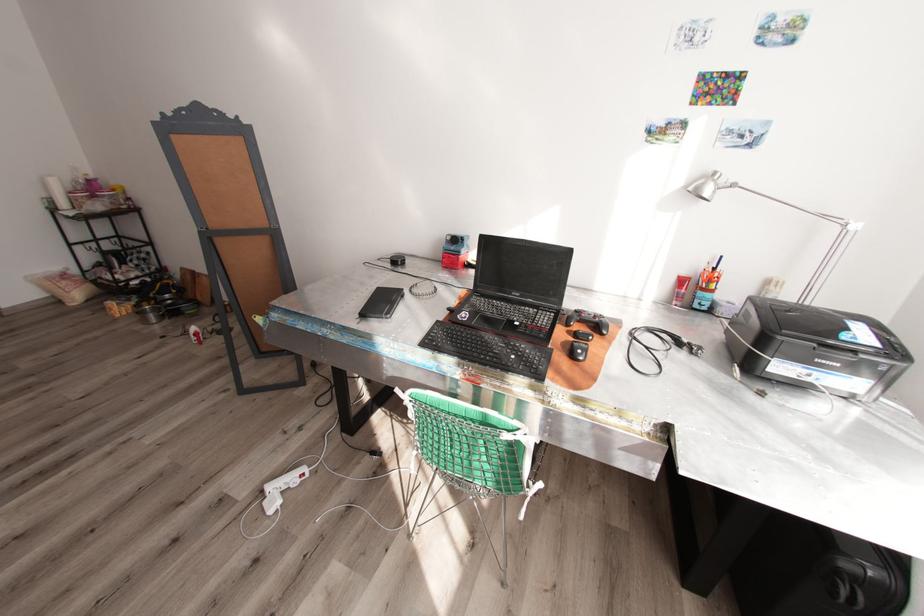
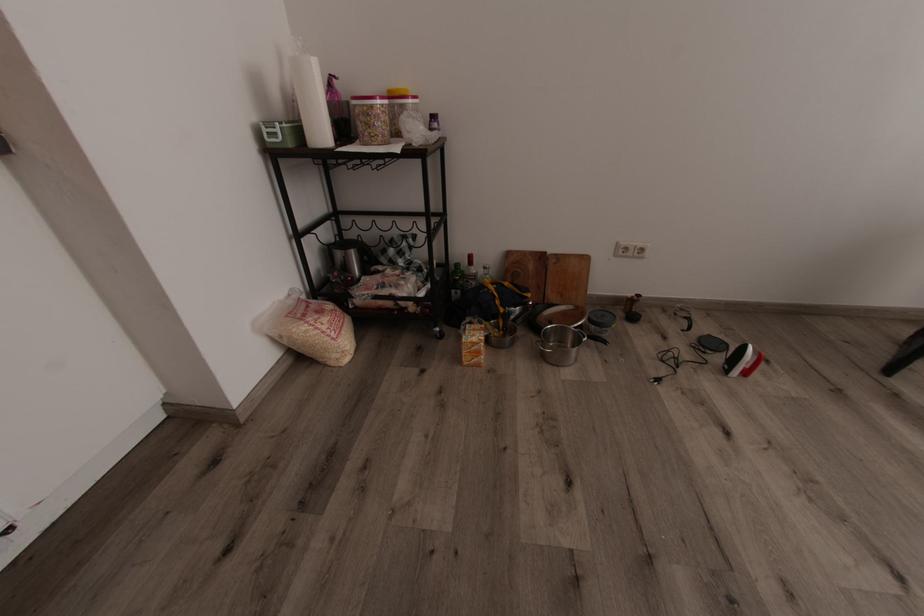
In the second image, find the point that corresponds to point 81,199 in the first image.

(382, 116)